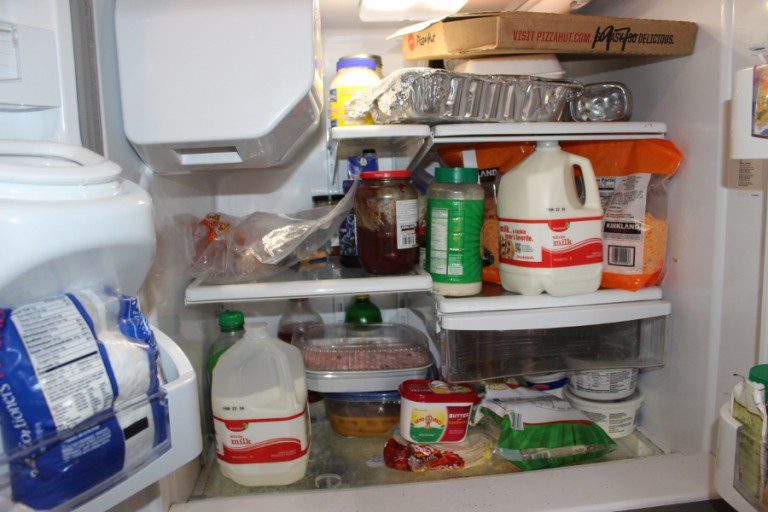
Where is `pizza box`? Image resolution: width=768 pixels, height=512 pixels. pizza box is located at coordinates (528, 31).